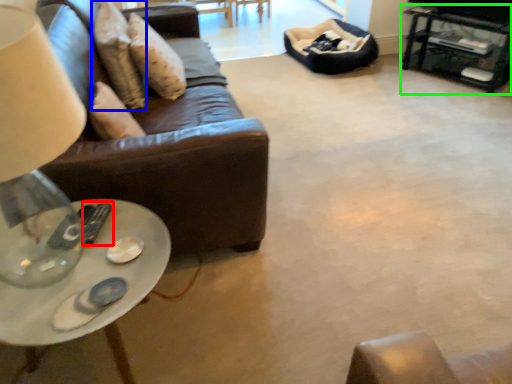
Question: Considering the real-world distances, which object is closest to remote (highlighted by a red box)? pillow (highlighted by a blue box) or table (highlighted by a green box).

Choices:
 (A) pillow
 (B) table

Answer: (A)